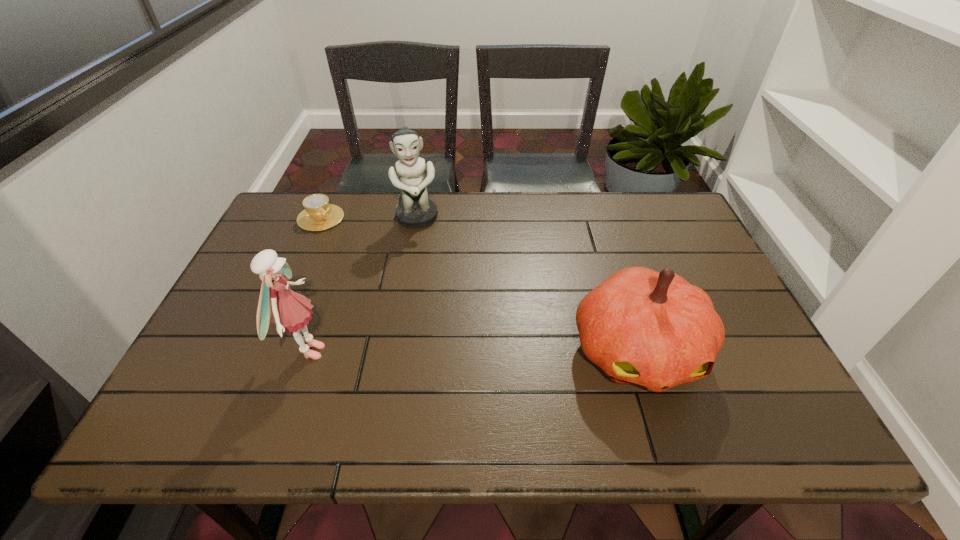
Where is `vacant region at the far edge of the desktop`? Image resolution: width=960 pixels, height=540 pixels. vacant region at the far edge of the desktop is located at coordinates (456, 202).

You are a GUI agent. You are given a task and a screenshot of the screen. Output one action in this format:
    pyautogui.click(x=<x>, y=<y>)
    Task: Click on the vacant space at the near edge of the desktop
    Image resolution: width=960 pixels, height=540 pixels.
    Given the screenshot: What is the action you would take?
    pyautogui.click(x=474, y=376)

Locate an element on the screen. vacant area at the right edge is located at coordinates (717, 289).

Identify the location of free point at the far right corner. Image resolution: width=960 pixels, height=540 pixels. (677, 212).

In the image, there is a desktop. Where is `vacant region at the near right corner`? The width and height of the screenshot is (960, 540). vacant region at the near right corner is located at coordinates pos(778,388).

Where is `vacant space that's between the rightmost object and the doll`? vacant space that's between the rightmost object and the doll is located at coordinates [472, 352].

Locate an element on the screen. The height and width of the screenshot is (540, 960). free spot between the rightmost object and the doll is located at coordinates (472, 352).

Where is `empty location between the third object from left to right and the third tallest object`? The width and height of the screenshot is (960, 540). empty location between the third object from left to right and the third tallest object is located at coordinates (527, 285).

Locate an element on the screen. The image size is (960, 540). free space between the cup and the second object from right to left is located at coordinates (369, 218).

Locate an element on the screen. This screenshot has height=540, width=960. vacant space that's between the cup and the third object from left to right is located at coordinates (369, 218).